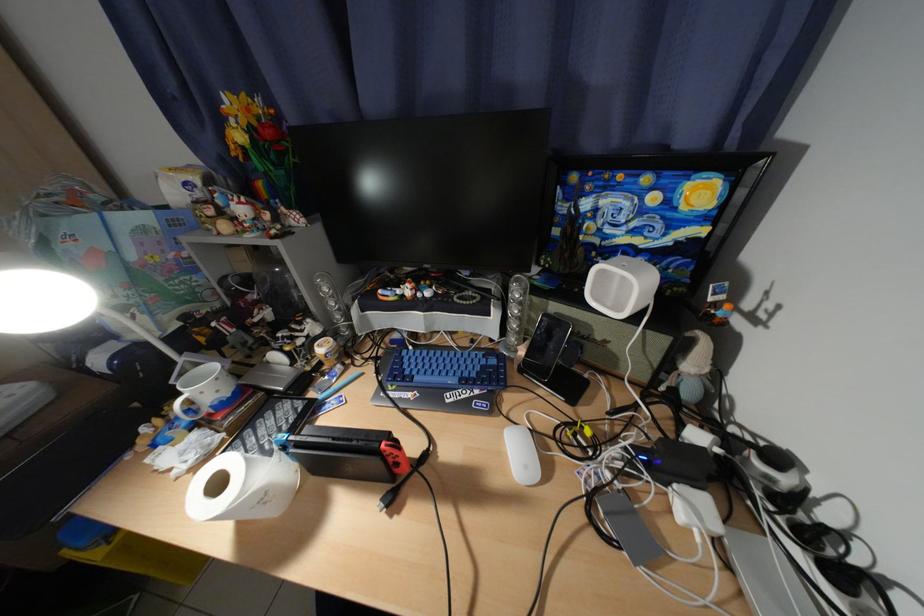
Find the location of a particular element. Image resolution: width=924 pixels, height=616 pixels. red controller joystick is located at coordinates [395, 456].